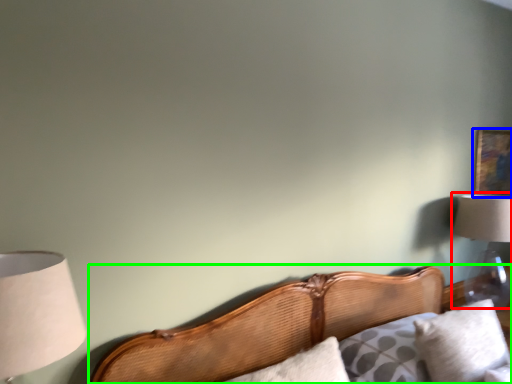
Question: Estimate the real-world distances between objects in this image. Which object is closer to lamp (highlighted by a red box), picture frame (highlighted by a blue box) or bed (highlighted by a green box)?

Choices:
 (A) picture frame
 (B) bed

Answer: (A)